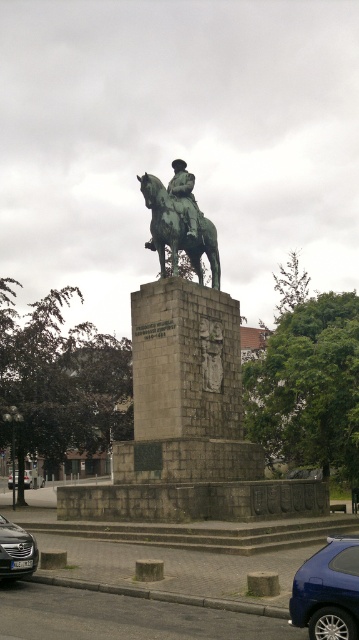
You are a photographer planning to take a photo of the equestrian statue in the public square. You need to position yourself so that both the blue metallic car at lower right and the black glossy car at lower left are visible in the frame. Which car should you place closer to the statue to ensure both are in the shot?

To include both the blue metallic car at lower right and the black glossy car at lower left in the photo, position yourself so that the black glossy car at lower left is closer to the statue. Since the blue metallic car at lower right is larger, placing the smaller black glossy car closer will help balance their sizes in the frame, ensuring both are visible.

You are standing in the public square and want to take a photo of the green polished metal horse at center. If you are positioned at the origin point, which is the bottom left corner of the square, what are the coordinates of the horse?

The coordinates of the green polished metal horse at center are at point [178,230].